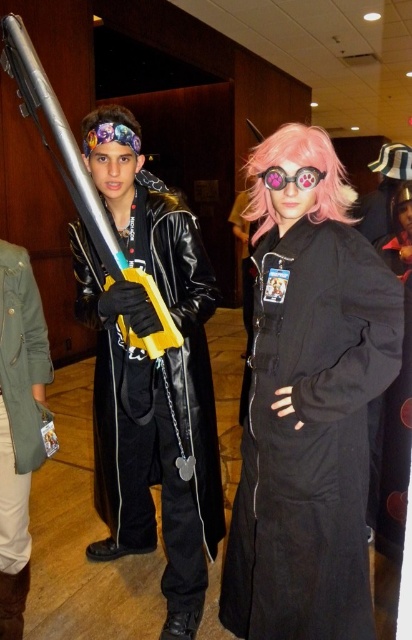
Question: Is green matte jacket at lower left further to camera compared to brushed metal toy gun at left?

Choices:
 (A) no
 (B) yes

Answer: (B)

Question: Which point is closer to the camera?

Choices:
 (A) pink silky hair at center
 (B) pink matte/glass goggles at center

Answer: (B)

Question: Considering the real-world distances, which object is farthest from the floral fabric headband at upper center?

Choices:
 (A) pink matte/glass goggles at center
 (B) leather jacket at center

Answer: (B)

Question: Is leather jacket at center below pink synthetic wig at center?

Choices:
 (A) no
 (B) yes

Answer: (B)

Question: Where is pink matte/black coat at center located in relation to green matte jacket at lower left in the image?

Choices:
 (A) above
 (B) below

Answer: (A)

Question: Which of the following is the farthest from the observer?

Choices:
 (A) pink synthetic wig at center
 (B) brushed metal toy gun at left
 (C) pink matte/glass goggles at center
 (D) green matte jacket at lower left

Answer: (D)